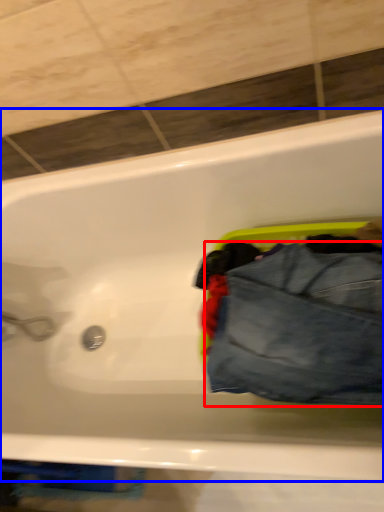
Question: Which object appears farthest to the camera in this image, trousers (highlighted by a red box) or bathtub (highlighted by a blue box)?

Choices:
 (A) trousers
 (B) bathtub

Answer: (A)